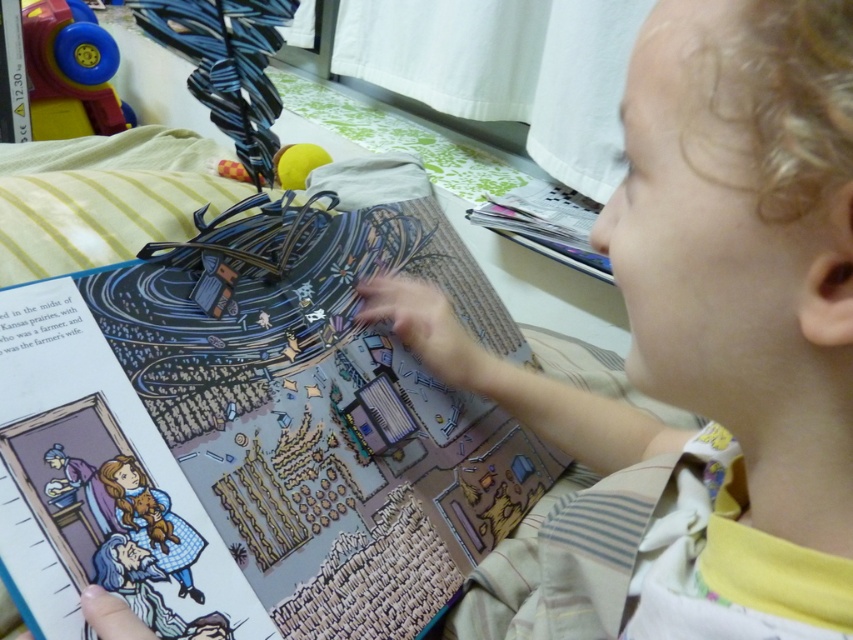
Looking at this image, you are a tailor who needs to determine if the smooth beige shirt at center can fit into a storage box designed for items thinner than the colorful paper comic book at center. Can it fit?

The smooth beige shirt at center is thinner than the colorful paper comic book at center, so it can fit into the storage box designed for items thinner than the colorful paper comic book at center.

You are a parent observing your child reading a book. You notice the smooth beige shirt at center and the rubberized plastic toy at upper left. Which object is closer to the bottom of the image?

The smooth beige shirt at center is positioned under the rubberized plastic toy at upper left, so it is closer to the bottom of the image.